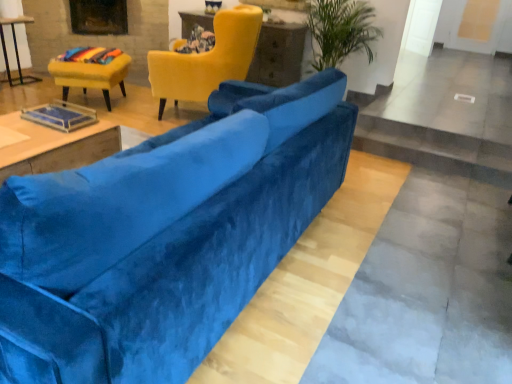
Question: Is velvet blue couch at center far from velvet yellow armchair at upper center, arranged as the first chair when viewed from the right?

Choices:
 (A) no
 (B) yes

Answer: (B)

Question: Can you confirm if velvet blue couch at center is wider than velvet yellow armchair at upper center, the 2th chair when ordered from left to right?

Choices:
 (A) no
 (B) yes

Answer: (A)

Question: Does velvet blue couch at center have a greater height compared to velvet yellow armchair at upper center, the 2th chair when ordered from left to right?

Choices:
 (A) yes
 (B) no

Answer: (B)

Question: Considering the relative sizes of velvet blue couch at center and velvet yellow armchair at upper center, arranged as the first chair when viewed from the right, in the image provided, is velvet blue couch at center thinner than velvet yellow armchair at upper center, arranged as the first chair when viewed from the right,?

Choices:
 (A) no
 (B) yes

Answer: (B)

Question: Is velvet blue couch at center in front of velvet yellow armchair at upper center, the 2th chair when ordered from left to right?

Choices:
 (A) no
 (B) yes

Answer: (B)

Question: Is matte yellow table at upper center, which ranks as the 1th table in back-to-front order, to the left or to the right of velvet yellow chair at upper left, which is counted as the 2th chair, starting from the right, in the image?

Choices:
 (A) right
 (B) left

Answer: (A)

Question: Looking at their shapes, would you say matte yellow table at upper center, placed as the third table when sorted from left to right, is wider or thinner than velvet yellow chair at upper left, which is the first chair in left-to-right order?

Choices:
 (A) thin
 (B) wide

Answer: (A)

Question: From a real-world perspective, is matte yellow table at upper center, the first table in the top-to-bottom sequence, physically located above or below velvet yellow chair at upper left, which is the first chair in left-to-right order?

Choices:
 (A) below
 (B) above

Answer: (B)

Question: Is matte yellow table at upper center, which is counted as the third table, starting from the front, bigger or smaller than velvet yellow chair at upper left, which is the first chair in left-to-right order?

Choices:
 (A) big
 (B) small

Answer: (A)

Question: Does point (10, 23) appear closer or farther from the camera than point (89, 64)?

Choices:
 (A) closer
 (B) farther

Answer: (B)

Question: From the image's perspective, is matte black table at left, the second table from the top, positioned above or below velvet yellow chair at upper left, which is the first chair in left-to-right order?

Choices:
 (A) below
 (B) above

Answer: (B)

Question: Considering the positions of matte black table at left, the 2th table in the back-to-front sequence, and velvet yellow chair at upper left, which is counted as the 2th chair, starting from the right, in the image, is matte black table at left, the 2th table in the back-to-front sequence, bigger or smaller than velvet yellow chair at upper left, which is counted as the 2th chair, starting from the right,?

Choices:
 (A) big
 (B) small

Answer: (B)

Question: From a real-world perspective, is matte black table at left, positioned as the second table in front-to-back order, physically located above or below velvet yellow chair at upper left, which is counted as the 2th chair, starting from the right?

Choices:
 (A) below
 (B) above

Answer: (B)

Question: From the image's perspective, is velvet blue couch at center located above or below rainbow fabric cushion at upper left?

Choices:
 (A) below
 (B) above

Answer: (A)

Question: Which is correct: velvet blue couch at center is inside rainbow fabric cushion at upper left, or outside of it?

Choices:
 (A) inside
 (B) outside

Answer: (B)